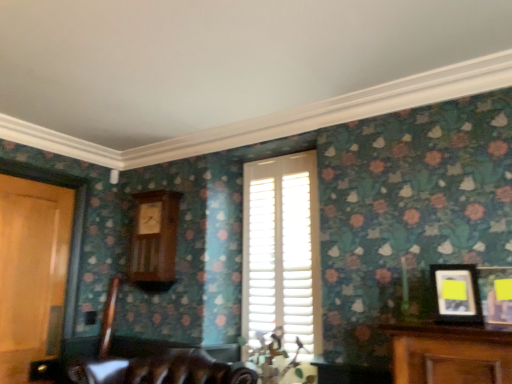
Question: Is white wooden shutters at center situated inside yellow matte picture frame at right, the second picture frame viewed from the left, or outside?

Choices:
 (A) inside
 (B) outside

Answer: (B)

Question: Does point (262, 286) appear closer or farther from the camera than point (481, 271)?

Choices:
 (A) closer
 (B) farther

Answer: (B)

Question: Estimate the real-world distances between objects in this image. Which object is closer to the yellow matte picture frame at right, positioned as the 1th picture frame in right-to-left order?

Choices:
 (A) wooden door at left
 (B) white wooden shutters at center
 (C) matte black picture frame at right, the first picture frame positioned from the left
 (D) wooden clock at center-left

Answer: (C)

Question: Based on their relative distances, which object is farther from the yellow matte picture frame at right, the second picture frame viewed from the left?

Choices:
 (A) wooden door at left
 (B) white wooden shutters at center
 (C) matte black picture frame at right, the first picture frame positioned from the left
 (D) wooden clock at center-left

Answer: (A)